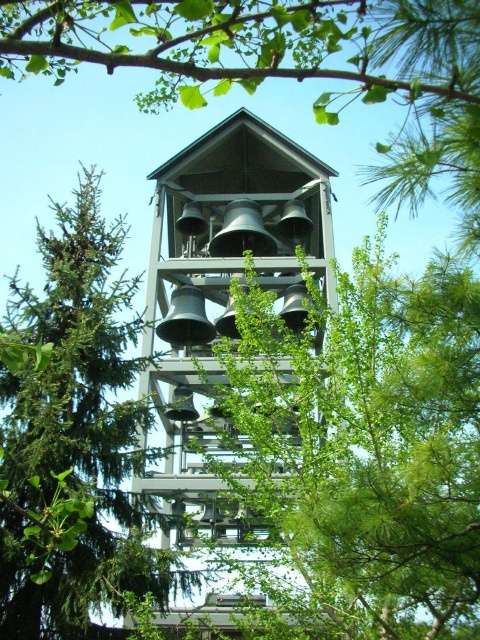
Between green pine tree at center and metallic gray bells at center, which one is positioned higher?

green pine tree at center is above.

Does point (28, 566) come in front of point (313, 157)?

Yes.

Is point (12, 602) farther from viewer compared to point (284, 156)?

No, (12, 602) is in front of (284, 156).

I want to click on green pine tree at center, so click(x=73, y=436).